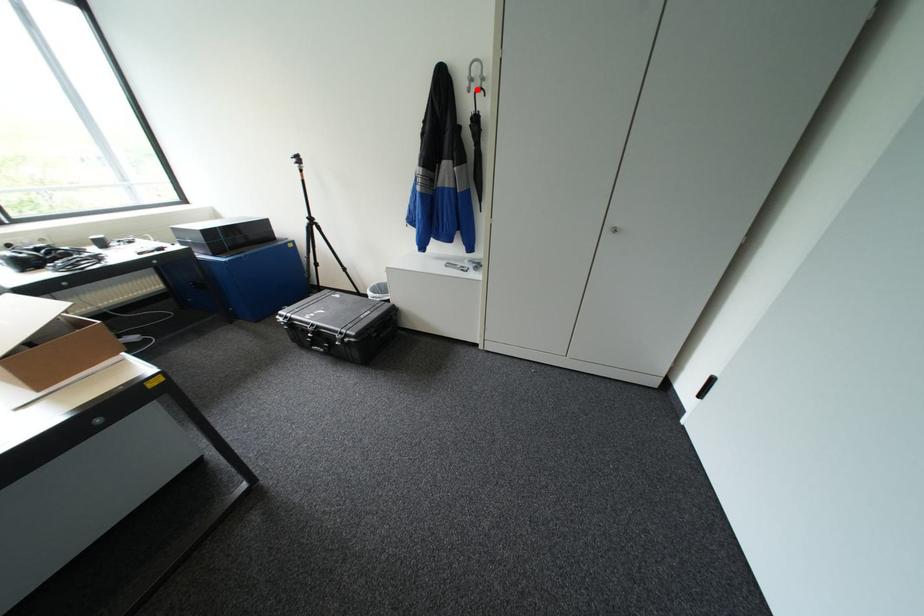
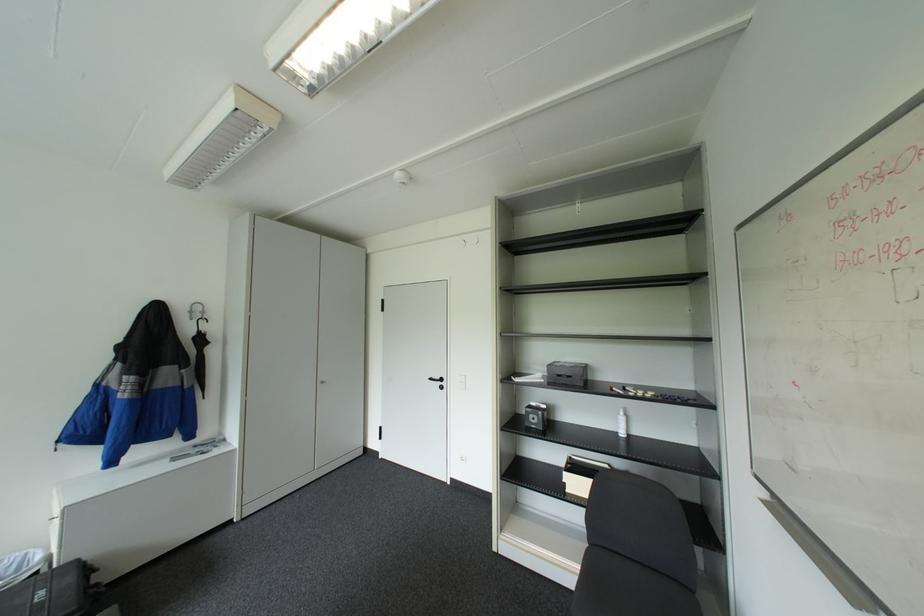
Question: I am providing you with two images of the same scene from different viewpoints. Image1 has a red point marked. In image2, the corresponding 3D location appears at what relative position? Reply with the corresponding letter.

Choices:
 (A) Closer
 (B) Farther

Answer: (B)